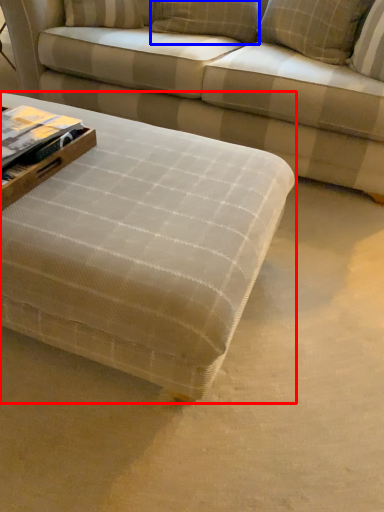
Question: Among these objects, which one is farthest to the camera, table (highlighted by a red box) or pillow (highlighted by a blue box)?

Choices:
 (A) table
 (B) pillow

Answer: (B)